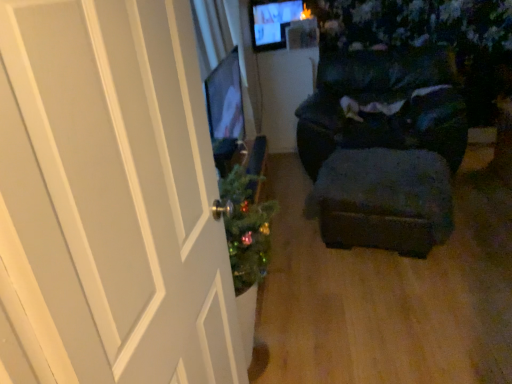
Question: Does velvet dark blue stool at center have a lesser width compared to white wood door at left?

Choices:
 (A) yes
 (B) no

Answer: (B)

Question: Is white wood door at left at the back of velvet dark blue stool at center?

Choices:
 (A) no
 (B) yes

Answer: (A)

Question: Would you say velvet dark blue stool at center is a long distance from white wood door at left?

Choices:
 (A) no
 (B) yes

Answer: (B)

Question: Does velvet dark blue stool at center touch white wood door at left?

Choices:
 (A) no
 (B) yes

Answer: (A)

Question: Could you tell me if velvet dark blue stool at center is facing white wood door at left?

Choices:
 (A) no
 (B) yes

Answer: (B)

Question: Would you say dark fabric chair at center is to the left or to the right of velvet dark blue stool at center in the picture?

Choices:
 (A) left
 (B) right

Answer: (B)

Question: From the image's perspective, is dark fabric chair at center above or below velvet dark blue stool at center?

Choices:
 (A) below
 (B) above

Answer: (B)

Question: Is dark fabric chair at center spatially inside velvet dark blue stool at center, or outside of it?

Choices:
 (A) inside
 (B) outside

Answer: (B)

Question: In the image, is dark fabric chair at center positioned in front of or behind velvet dark blue stool at center?

Choices:
 (A) front
 (B) behind

Answer: (B)

Question: From a real-world perspective, is white wood door at left positioned above or below velvet dark blue stool at center?

Choices:
 (A) above
 (B) below

Answer: (A)

Question: Is white wood door at left inside or outside of velvet dark blue stool at center?

Choices:
 (A) outside
 (B) inside

Answer: (A)

Question: Looking at the image, does white wood door at left seem bigger or smaller compared to velvet dark blue stool at center?

Choices:
 (A) small
 (B) big

Answer: (A)

Question: Relative to velvet dark blue stool at center, is white wood door at left in front or behind?

Choices:
 (A) behind
 (B) front

Answer: (B)

Question: In the image, is dark fabric chair at center on the left side or the right side of white wood door at left?

Choices:
 (A) left
 (B) right

Answer: (B)

Question: Considering the positions of dark fabric chair at center and white wood door at left in the image, is dark fabric chair at center wider or thinner than white wood door at left?

Choices:
 (A) thin
 (B) wide

Answer: (B)